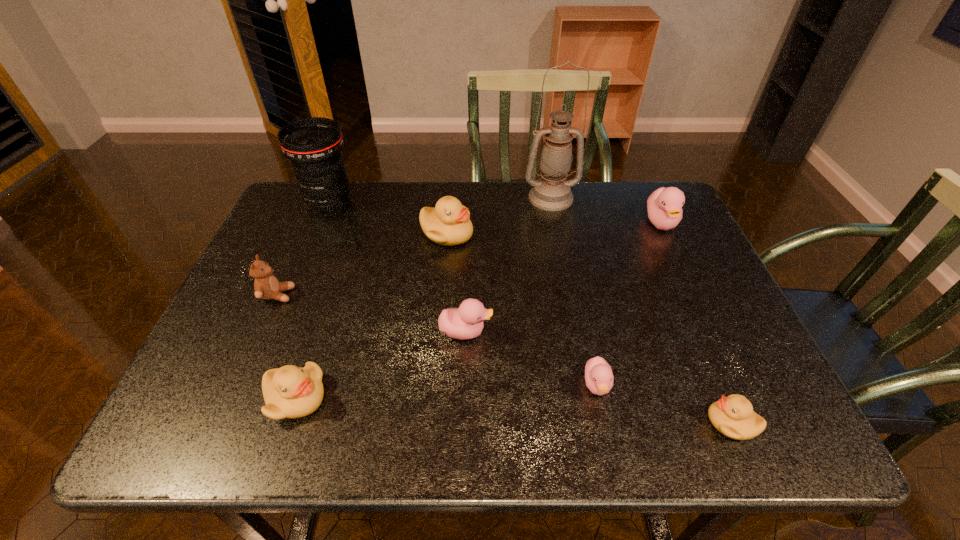
Identify the location of teddy bear present at the left edge. (266, 286).

Locate an element on the screen. The height and width of the screenshot is (540, 960). object at the far left corner is located at coordinates (314, 145).

This screenshot has width=960, height=540. Find the location of `object located at the far right corner`. object located at the far right corner is located at coordinates (664, 206).

Where is `object present at the near right corner`? Image resolution: width=960 pixels, height=540 pixels. object present at the near right corner is located at coordinates (733, 416).

In the image, there is a desktop. Where is `vacant space at the far edge`? This screenshot has height=540, width=960. vacant space at the far edge is located at coordinates (526, 183).

Locate an element on the screen. The height and width of the screenshot is (540, 960). vacant region at the near edge is located at coordinates (658, 426).

You are a GUI agent. You are given a task and a screenshot of the screen. Output one action in this format:
    pyautogui.click(x=<x>, y=<y>)
    Task: Click on the free point at the left edge
    
    Given the screenshot: What is the action you would take?
    pyautogui.click(x=317, y=251)

In the image, there is a desktop. At what (x,y) coordinates should I click in order to perform the action: click on vacant space at the right edge. Please return your answer as a coordinate pair (x, y). The height and width of the screenshot is (540, 960). Looking at the image, I should click on (648, 242).

Locate an element on the screen. The image size is (960, 540). blank space at the near left corner is located at coordinates (222, 417).

This screenshot has height=540, width=960. I want to click on vacant area at the far right corner, so click(629, 201).